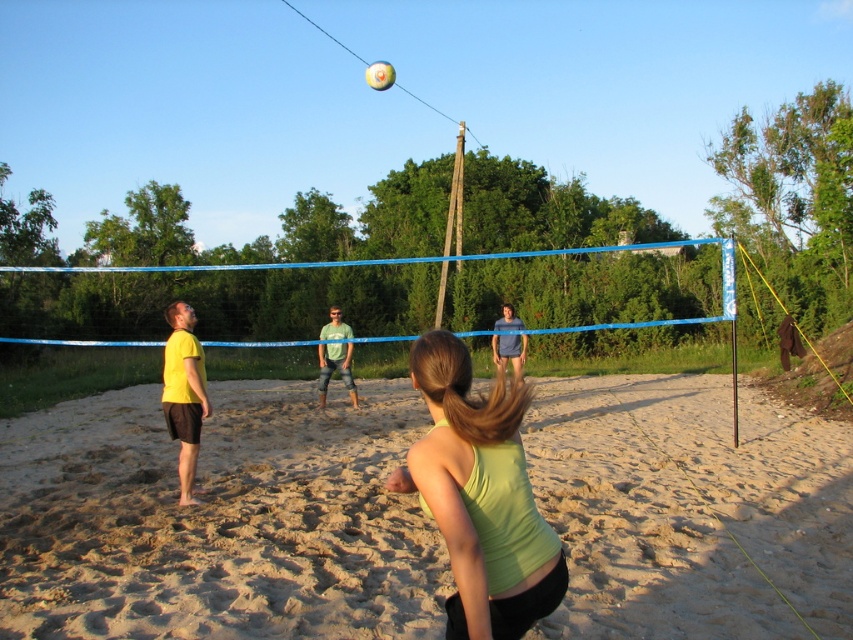
You are a photographer aiming to capture the volleyball player in the center of the image. The volleyball is at point [334,369]. Is the volleyball positioned over the green matte shirt at center?

The point [334,369] is on the green matte shirt at center, so yes, the volleyball is positioned over the green matte shirt at center.

You are a photographer trying to capture the volleyball and the player in the same frame. Based on the scene, which object is closer to the camera between the blue fabric shirt at center and the white matte volleyball at upper center?

The blue fabric shirt at center is closer to the camera because it is not as tall as the white matte volleyball at upper center, indicating it is positioned in front.